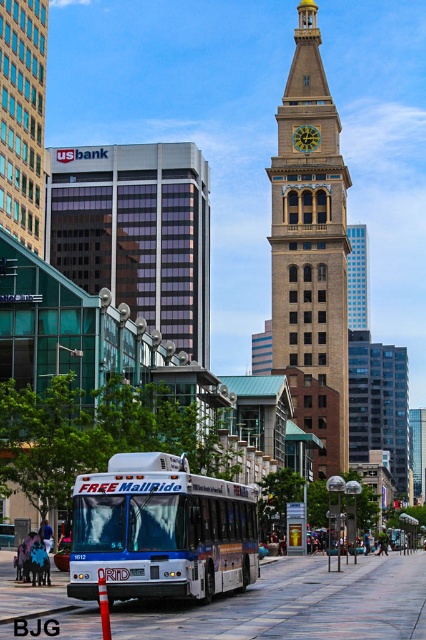
Question: Is brown stone clock tower at center closer to camera compared to blue matte bus at center?

Choices:
 (A) yes
 (B) no

Answer: (B)

Question: Is brown stone clock tower at center wider than blue matte bus at center?

Choices:
 (A) no
 (B) yes

Answer: (B)

Question: Can you confirm if brown stone clock tower at center is positioned to the right of blue matte bus at center?

Choices:
 (A) yes
 (B) no

Answer: (A)

Question: Among these points, which one is nearest to the camera?

Choices:
 (A) (106, 476)
 (B) (313, 128)

Answer: (A)